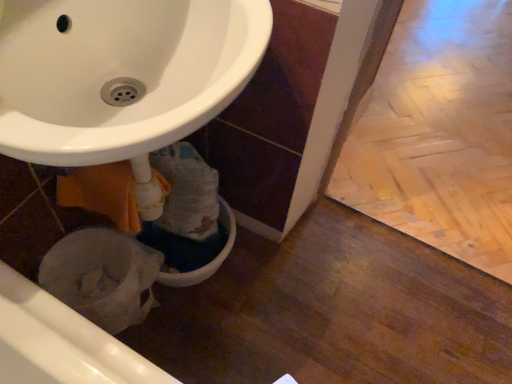
At what (x,y) coordinates should I click in order to perform the action: click on free spot above wooden parquet floor at lower right (from a real-world perspective). Please return your answer as a coordinate pair (x, y). This screenshot has height=384, width=512. Looking at the image, I should click on (450, 78).